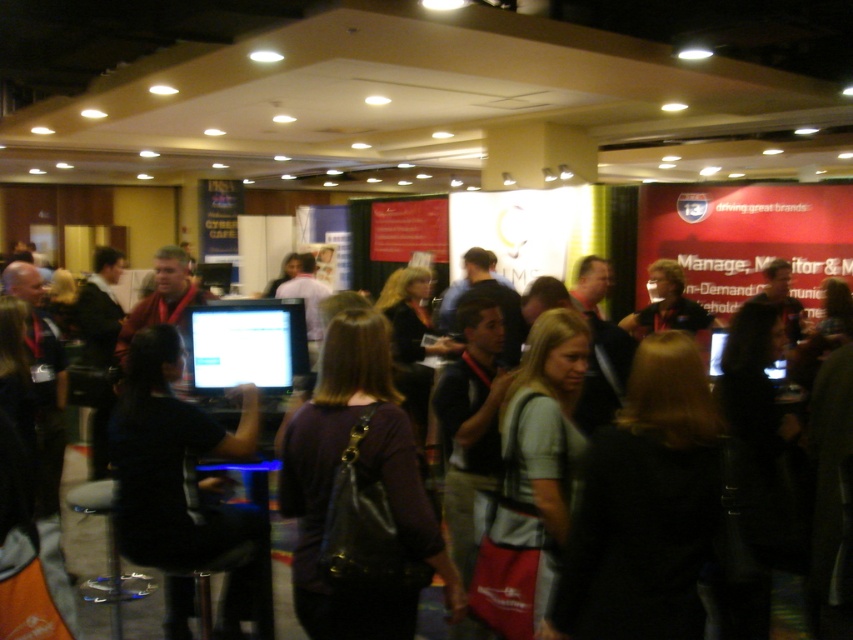
Question: Which of the following is the farthest from the observer?

Choices:
 (A) matte plastic monitor at center
 (B) black matte computer at center
 (C) dark purple fabric shirt at center

Answer: (A)

Question: Among these points, which one is farthest from the camera?

Choices:
 (A) (245, 449)
 (B) (209, 310)
 (C) (399, 572)

Answer: (B)

Question: Does dark purple fabric shirt at center come in front of black matte computer at center?

Choices:
 (A) yes
 (B) no

Answer: (A)

Question: Where is black matte computer at center located in relation to matte plastic monitor at center in the image?

Choices:
 (A) left
 (B) right

Answer: (A)

Question: Among these objects, which one is farthest from the camera?

Choices:
 (A) black matte computer at center
 (B) matte plastic monitor at center

Answer: (B)

Question: Is dark purple fabric shirt at center positioned in front of black matte computer at center?

Choices:
 (A) no
 (B) yes

Answer: (B)